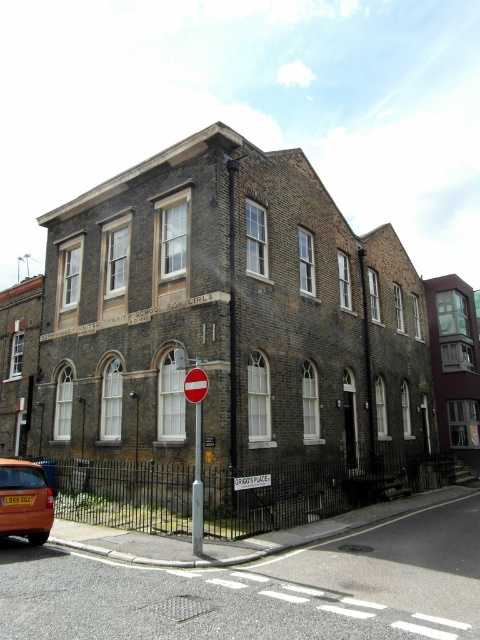
You are a delivery person needing to park your 1.5 meter wide delivery van in front of the building. The parking spot must be between the metallic pole at center and the black metal fence. Can you fit the van there?

The metallic pole at center is located at point [196,488]. However, without knowing the distance between the pole and the fence, it is impossible to determine if the van will fit. Please provide more information about the distance between the pole and the fence.

In the scene shown: You are standing at the corner of the street where the two story brick building is located. You see a point labeled as point (24, 500). What object does this point correspond to?

The point corresponds to the orange matte car at lower left.